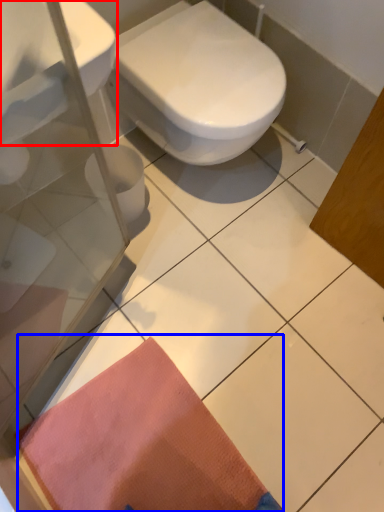
Question: Which object appears farthest to the camera in this image, sink (highlighted by a red box) or doormat (highlighted by a blue box)?

Choices:
 (A) sink
 (B) doormat

Answer: (B)